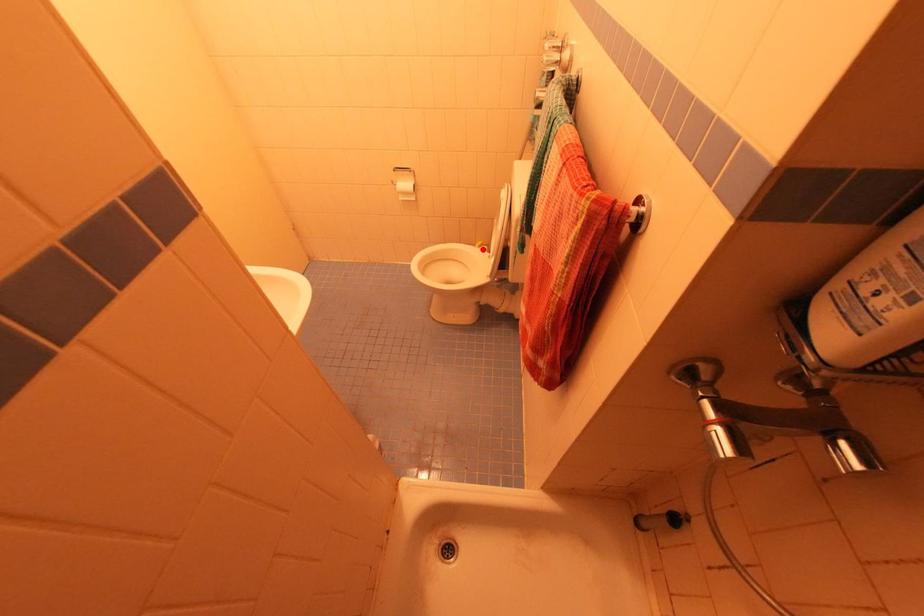
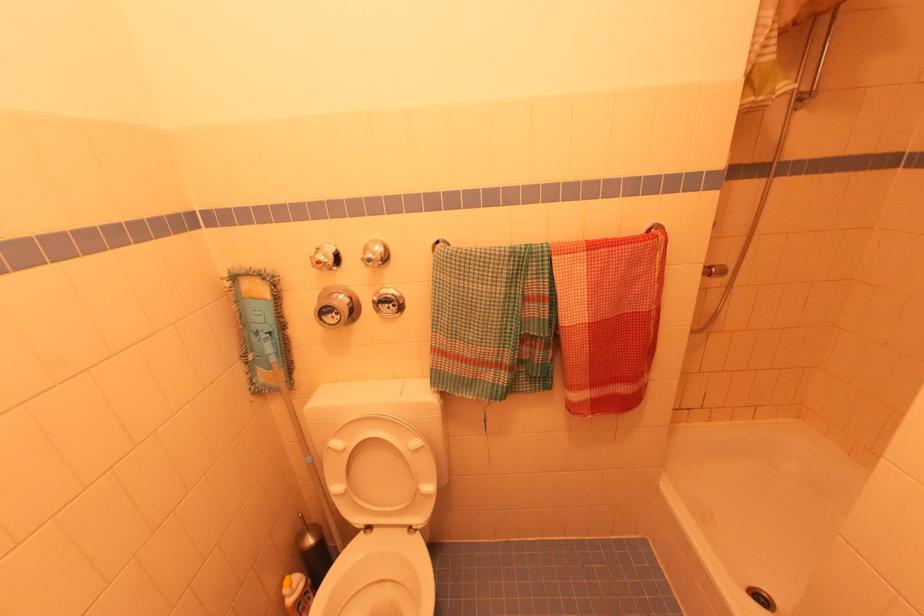
Where in the second image is the point corresponding to the highlighted location from the first image?

(296, 585)